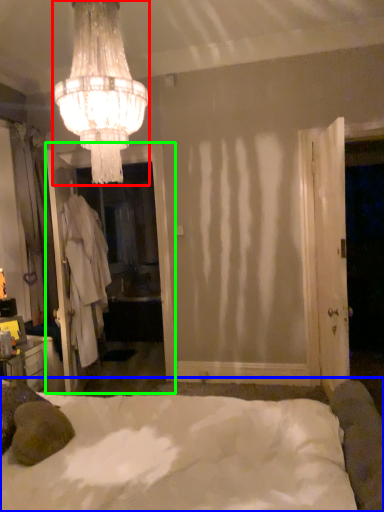
Question: Which object is the closest to the lamp (highlighted by a red box)? Choose among these: bed (highlighted by a blue box) or screen door (highlighted by a green box).

Choices:
 (A) bed
 (B) screen door

Answer: (A)